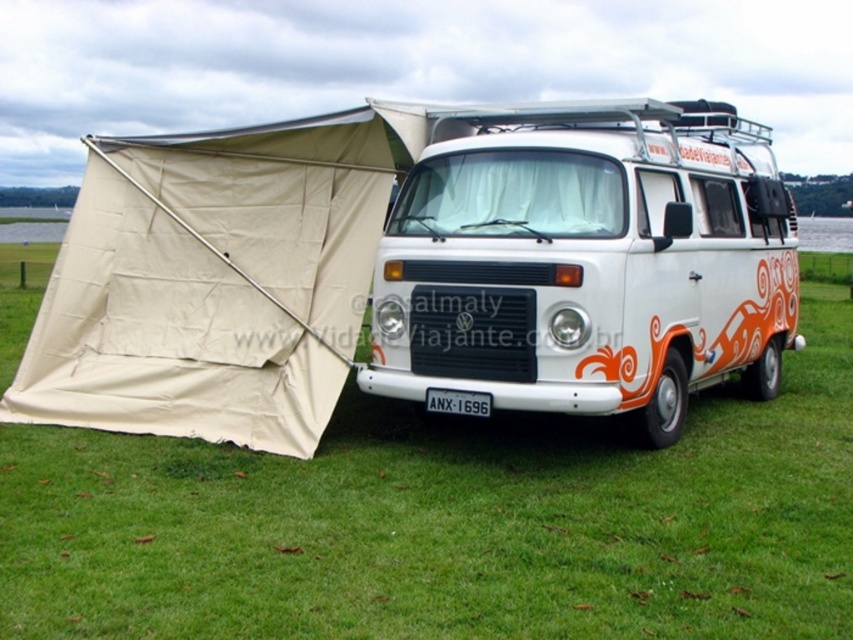
Question: Which point is farther to the camera?

Choices:
 (A) green grass at lower center
 (B) white plastic license plate at center
 (C) white glossy van at center

Answer: (B)

Question: Which of the following is the closest to the observer?

Choices:
 (A) white glossy van at center
 (B) green grass at lower center
 (C) white plastic license plate at center

Answer: (B)

Question: Estimate the real-world distances between objects in this image. Which object is closer to the white plastic license plate at center?

Choices:
 (A) white glossy van at center
 (B) green grass at lower center

Answer: (B)

Question: Is white glossy van at center closer to the viewer compared to white plastic license plate at center?

Choices:
 (A) no
 (B) yes

Answer: (B)

Question: From the image, what is the correct spatial relationship of white glossy van at center in relation to white plastic license plate at center?

Choices:
 (A) right
 (B) left

Answer: (A)

Question: In this image, where is white glossy van at center located relative to white plastic license plate at center?

Choices:
 (A) above
 (B) below

Answer: (A)